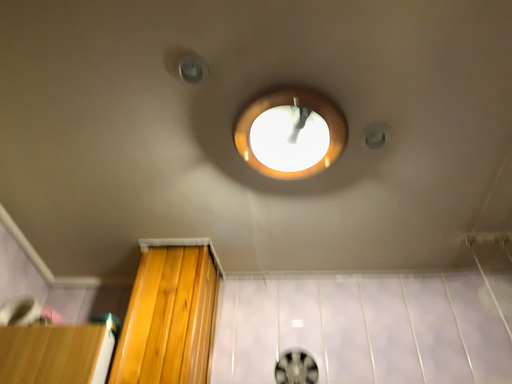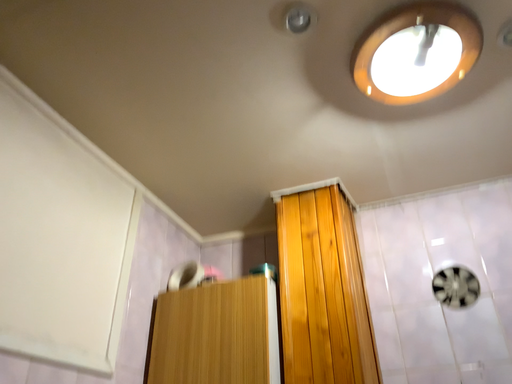
Question: How did the camera likely rotate when shooting the video?

Choices:
 (A) rotated left
 (B) rotated right

Answer: (A)